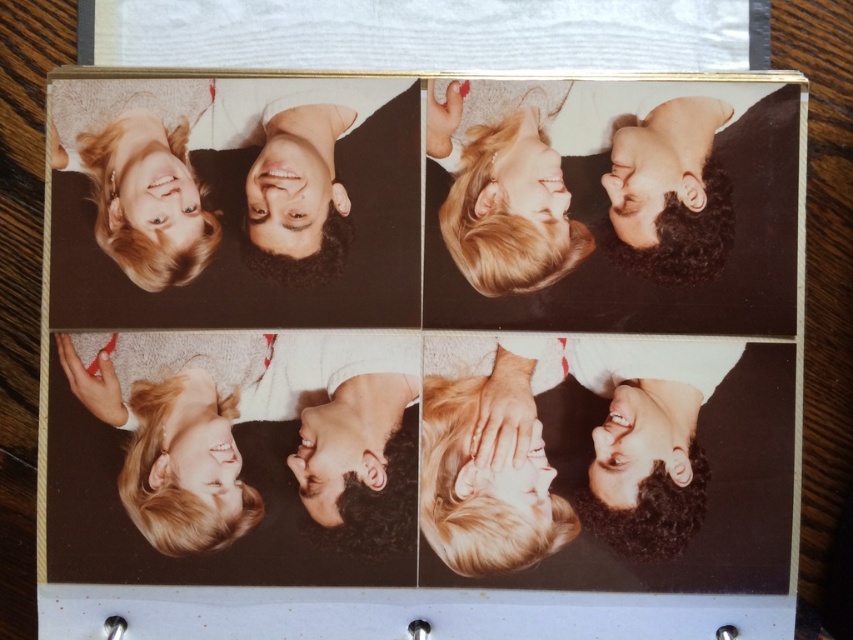
Who is taller, blonde hair at upper center or curly hair at upper right?

Standing taller between the two is blonde hair at upper center.

What do you see at coordinates (503, 198) in the screenshot? I see `blonde hair at upper center` at bounding box center [503, 198].

Is point (479, 147) less distant than point (614, 243)?

No, (479, 147) is behind (614, 243).

What are the coordinates of `blonde hair at upper center` in the screenshot? It's located at (503, 198).

Is point (447, 371) farther from camera compared to point (302, 129)?

Yes, point (447, 371) is farther from viewer.

Is smooth skin face at bottom right thinner than smooth skin face at upper left?

No, smooth skin face at bottom right is not thinner than smooth skin face at upper left.

Is point (653, 394) farther from camera compared to point (312, 224)?

That is False.

Where is `smooth skin face at bottom right`? The width and height of the screenshot is (853, 640). smooth skin face at bottom right is located at coordinates (544, 449).

How much distance is there between blonde hair at bottom left and blonde hair at upper center?

They are 5.91 inches apart.

Does point (289, 456) come closer to viewer compared to point (561, 224)?

That is True.

I want to click on blonde hair at bottom left, so click(x=257, y=420).